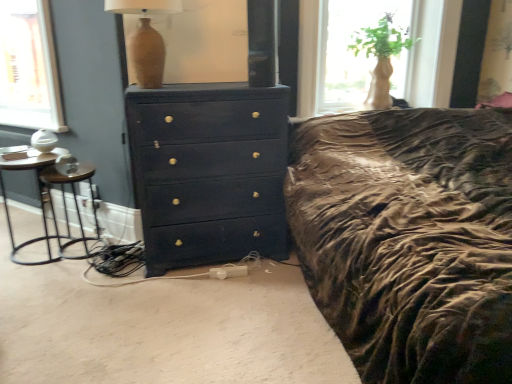
Question: Is translucent glass vase at upper right oriented away from matte dark blue dresser at center?

Choices:
 (A) yes
 (B) no

Answer: (B)

Question: From a real-world perspective, is translucent glass vase at upper right located beneath matte dark blue dresser at center?

Choices:
 (A) no
 (B) yes

Answer: (A)

Question: From the image's perspective, does translucent glass vase at upper right appear lower than matte dark blue dresser at center?

Choices:
 (A) yes
 (B) no

Answer: (B)

Question: Is translucent glass vase at upper right bigger than matte dark blue dresser at center?

Choices:
 (A) yes
 (B) no

Answer: (B)

Question: Considering the relative sizes of translucent glass vase at upper right and matte dark blue dresser at center in the image provided, is translucent glass vase at upper right thinner than matte dark blue dresser at center?

Choices:
 (A) yes
 (B) no

Answer: (A)

Question: From the image's perspective, does translucent glass vase at upper right appear higher than matte dark blue dresser at center?

Choices:
 (A) yes
 (B) no

Answer: (A)

Question: Does metallic silver side table at left appear on the right side of black metal bar stool at left?

Choices:
 (A) no
 (B) yes

Answer: (A)

Question: Does metallic silver side table at left contain black metal bar stool at left?

Choices:
 (A) no
 (B) yes

Answer: (B)

Question: Is metallic silver side table at left outside black metal bar stool at left?

Choices:
 (A) no
 (B) yes

Answer: (A)

Question: Is metallic silver side table at left closer to the viewer compared to black metal bar stool at left?

Choices:
 (A) yes
 (B) no

Answer: (A)

Question: From a real-world perspective, does metallic silver side table at left sit lower than black metal bar stool at left?

Choices:
 (A) yes
 (B) no

Answer: (B)

Question: Does metallic silver side table at left have a larger size compared to black metal bar stool at left?

Choices:
 (A) no
 (B) yes

Answer: (B)

Question: Is matte beige vase at upper center oriented away from translucent glass vase at upper right?

Choices:
 (A) yes
 (B) no

Answer: (B)